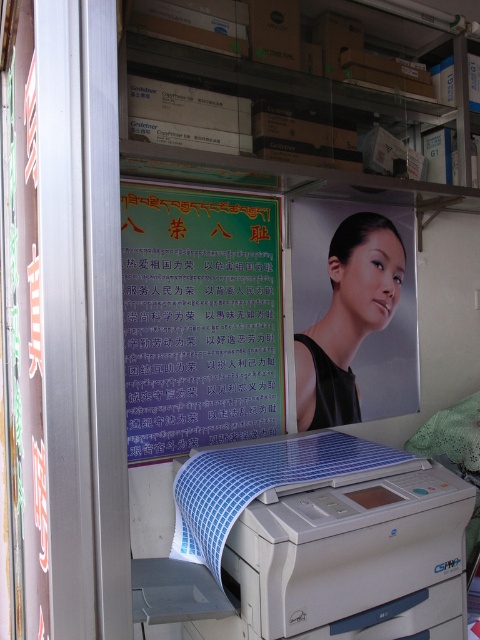
Can you confirm if green paper poster at center is positioned to the right of matte black portrait at center?

In fact, green paper poster at center is to the left of matte black portrait at center.

Where is `green paper poster at center`? green paper poster at center is located at coordinates (200, 317).

Is point (389, 588) more distant than point (360, 305)?

No, (389, 588) is closer to viewer.

Is white plastic printer at lower center above matte black portrait at center?

Incorrect, white plastic printer at lower center is not positioned above matte black portrait at center.

Is point (358, 566) positioned before point (392, 289)?

Yes.

Where is `white plastic printer at lower center`? This screenshot has width=480, height=640. white plastic printer at lower center is located at coordinates (328, 548).

Looking at this image, between green paper poster at center and white plastic printer at lower center, which one has more height?

green paper poster at center is taller.

Between green paper poster at center and white plastic printer at lower center, which one is positioned lower?

white plastic printer at lower center is below.

Who is more distant from viewer, (256, 381) or (230, 556)?

Point (256, 381)

This screenshot has height=640, width=480. Identify the location of green paper poster at center. pos(200,317).